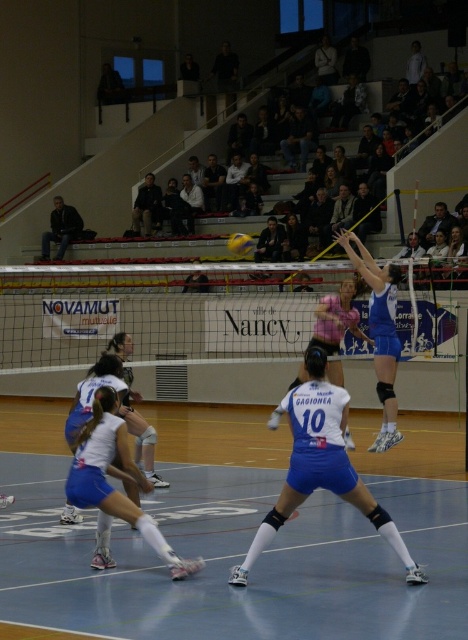
Who is taller, blue fabric volleyball net at upper center or white matte volleyball at center?

Standing taller between the two is white matte volleyball at center.

Does blue fabric volleyball net at upper center appear over white matte volleyball at center?

Correct, blue fabric volleyball net at upper center is located above white matte volleyball at center.

Is point (382, 372) positioned behind point (160, 486)?

No, it is not.

Identify the location of blue fabric volleyball net at upper center. pyautogui.click(x=380, y=332).

Does blue synthetic volleyball court at center have a lesser width compared to white matte uniform at center?

No.

Is blue synthetic volleyball court at center to the left of white matte uniform at center from the viewer's perspective?

Correct, you'll find blue synthetic volleyball court at center to the left of white matte uniform at center.

Between point (197, 433) and point (294, 461), which one is positioned in front?

Positioned in front is point (294, 461).

You are a GUI agent. You are given a task and a screenshot of the screen. Output one action in this format:
    pyautogui.click(x=<x>, y=<y>)
    Task: Click on the blue synthetic volleyball court at center
    Image resolution: width=468 pixels, height=640 pixels.
    Given the screenshot: What is the action you would take?
    pyautogui.click(x=271, y=545)

From the picture: Who is more distant from viewer, (302, 440) or (77, 497)?

The point (77, 497) is behind.

Between white matte uniform at center and white matte shorts at center, which one is positioned lower?

white matte shorts at center is lower down.

The height and width of the screenshot is (640, 468). Describe the element at coordinates (321, 467) in the screenshot. I see `white matte uniform at center` at that location.

What are the coordinates of `white matte uniform at center` in the screenshot? It's located at (321, 467).